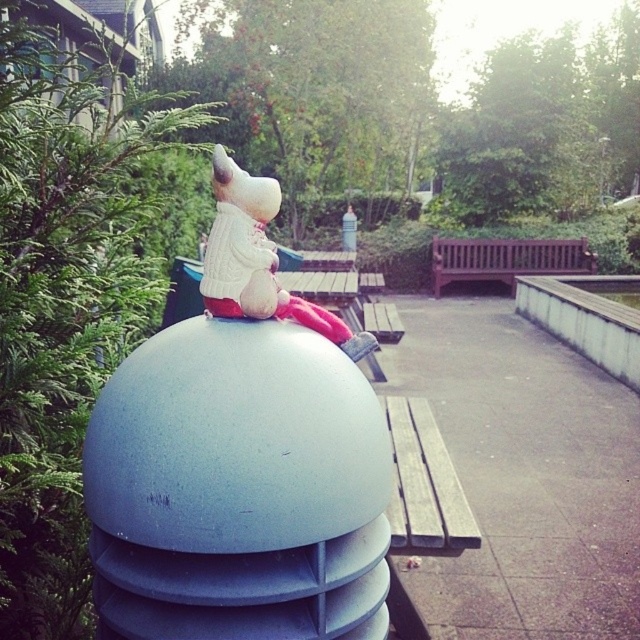
You are a visitor in the park and want to sit on the brown wooden bench at center. Is the white plush toy at center in your way?

The white plush toy at center is below the brown wooden bench at center, so it is not blocking your path to the bench. You can sit on the brown wooden bench at center without any obstruction.

You are a person with a height of 1.6 meters. You want to sit on either the wooden bench at right or the brown wooden bench at center. Which bench would allow you to sit comfortably without bending down too much?

The brown wooden bench at center has a greater height than the wooden bench at right. Since you are 1.6 meters tall, the brown wooden bench at center would likely provide a more comfortable seating position as it is taller and requires less bending.